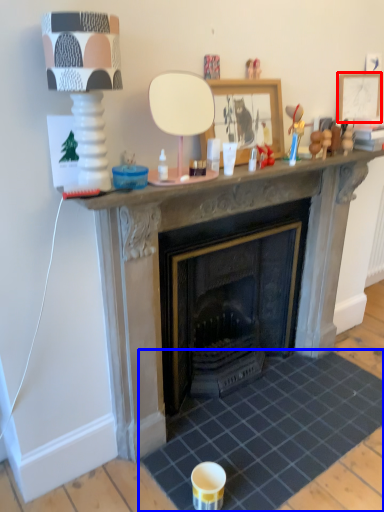
Question: Which of the following is the farthest to the observer, picture frame (highlighted by a red box) or tile (highlighted by a blue box)?

Choices:
 (A) picture frame
 (B) tile

Answer: (A)